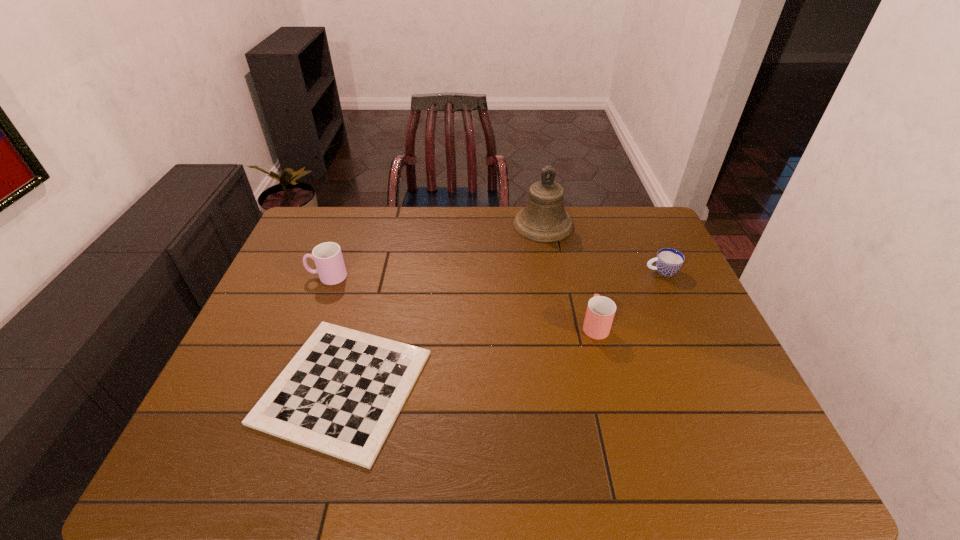
Select which cup is the second closest to the leftmost cup. Please provide its 2D coordinates. Your answer should be formatted as a tuple, i.e. [(x, y)], where the tuple contains the x and y coordinates of a point satisfying the conditions above.

[(668, 261)]

Where is `vacant space that satisfies the following two spatial constraints: 1. on the back side of the farthest object; 2. on the right side of the shortest object`? vacant space that satisfies the following two spatial constraints: 1. on the back side of the farthest object; 2. on the right side of the shortest object is located at coordinates (387, 225).